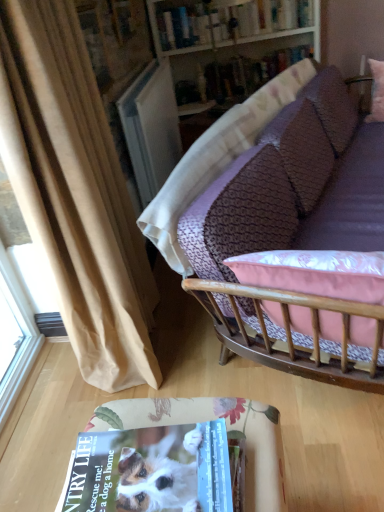
Question: Would you consider beige fabric curtain at left to be distant from purple fabric couch at upper right?

Choices:
 (A) yes
 (B) no

Answer: (B)

Question: From the image's perspective, is beige fabric curtain at left below purple fabric couch at upper right?

Choices:
 (A) no
 (B) yes

Answer: (B)

Question: Is beige fabric curtain at left looking in the opposite direction of purple fabric couch at upper right?

Choices:
 (A) yes
 (B) no

Answer: (B)

Question: Does beige fabric curtain at left appear on the left side of purple fabric couch at upper right?

Choices:
 (A) no
 (B) yes

Answer: (B)

Question: Can you confirm if beige fabric curtain at left is wider than purple fabric couch at upper right?

Choices:
 (A) no
 (B) yes

Answer: (A)

Question: Looking at their shapes, would you say hardcover book at upper center, positioned as the 1th book in top-to-bottom order, is wider or thinner than wooden bookshelf at upper center?

Choices:
 (A) wide
 (B) thin

Answer: (B)

Question: Does point (153, 34) appear closer or farther from the camera than point (286, 62)?

Choices:
 (A) closer
 (B) farther

Answer: (A)

Question: From the image's perspective, relative to wooden bookshelf at upper center, is hardcover book at upper center, which is counted as the second book, starting from the bottom, above or below?

Choices:
 (A) below
 (B) above

Answer: (B)

Question: From a real-world perspective, is hardcover book at upper center, which is counted as the second book, starting from the bottom, positioned above or below wooden bookshelf at upper center?

Choices:
 (A) below
 (B) above

Answer: (B)

Question: From a real-world perspective, is beige fabric curtain at left positioned above or below wooden bookshelf at upper center?

Choices:
 (A) below
 (B) above

Answer: (B)

Question: In terms of width, does beige fabric curtain at left look wider or thinner when compared to wooden bookshelf at upper center?

Choices:
 (A) wide
 (B) thin

Answer: (B)

Question: From the image's perspective, relative to wooden bookshelf at upper center, is beige fabric curtain at left above or below?

Choices:
 (A) above
 (B) below

Answer: (B)

Question: In terms of height, does beige fabric curtain at left look taller or shorter compared to wooden bookshelf at upper center?

Choices:
 (A) short
 (B) tall

Answer: (B)

Question: Is point (178, 250) positioned closer to the camera than point (301, 22)?

Choices:
 (A) farther
 (B) closer

Answer: (B)

Question: Which is correct: purple fabric couch at upper right is inside wooden bookshelf at upper center, or outside of it?

Choices:
 (A) inside
 (B) outside

Answer: (B)